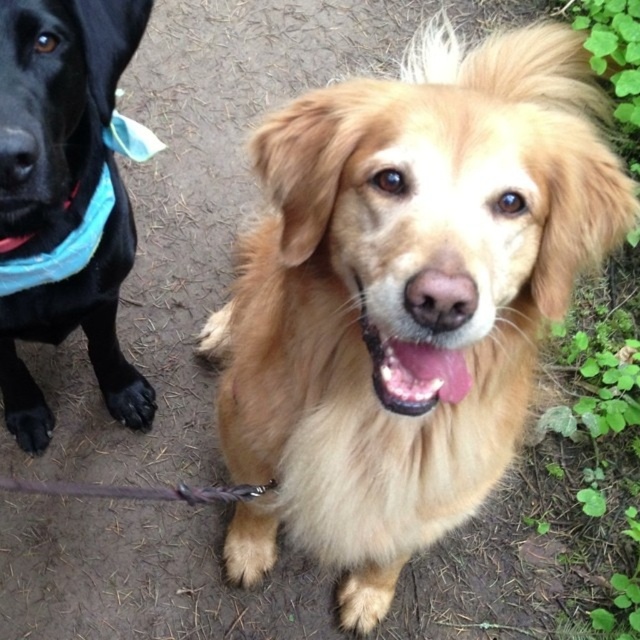
You are standing at the point labeled point (x=310, y=536) and want to throw a ball to a friend who is 1.11 meters away from you. Can you estimate whether your friend is within the throwing range of 1.1 meters?

The distance between you and your friend is exactly 1.11 meters, which is slightly beyond the 1.1 meters throwing range. Therefore, your friend is just outside the throwing range.